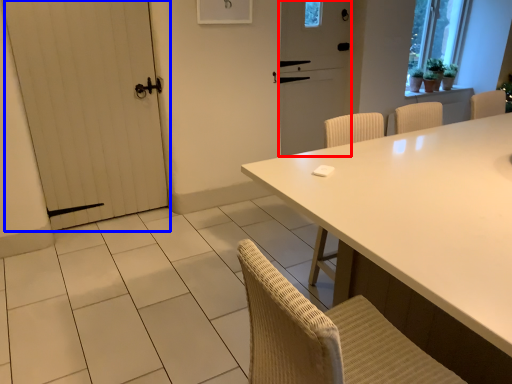
Question: Which object is closer to the camera taking this photo, screen door (highlighted by a red box) or door (highlighted by a blue box)?

Choices:
 (A) screen door
 (B) door

Answer: (B)